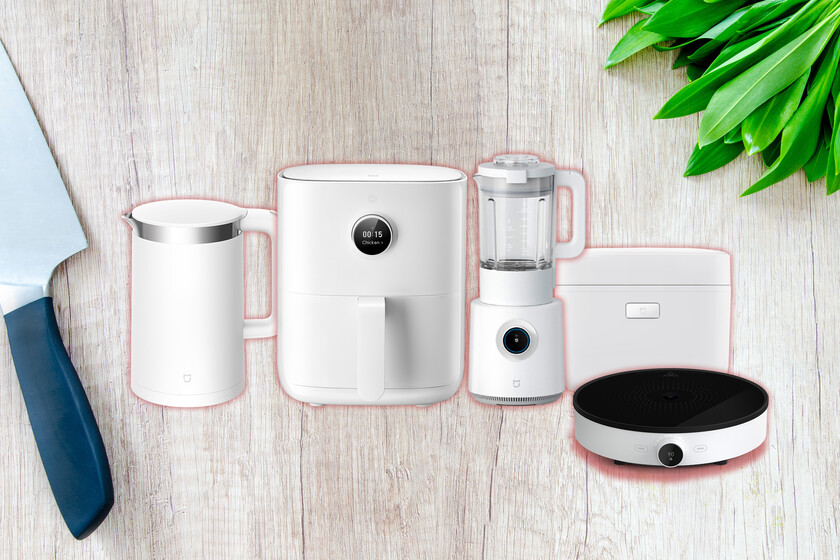
You are a GUI agent. You are given a task and a screenshot of the screen. Output one action in this format:
    pyautogui.click(x=<x>, y=<y>)
    Task: Click on the handle
    This screenshot has height=560, width=840.
    Given the screenshot: What is the action you would take?
    pyautogui.click(x=61, y=428)